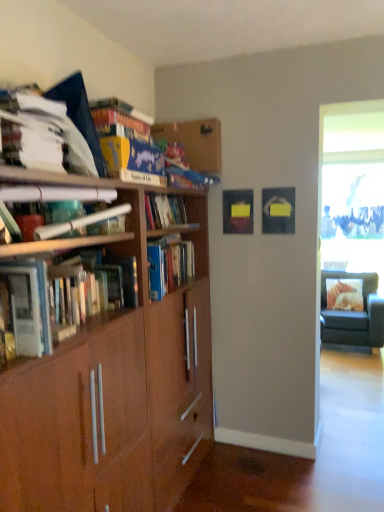
Question: Would you say brown wood bookcase at left is part of hardcover books at left, which appears as the 1th book when ordered from the bottom,'s contents?

Choices:
 (A) no
 (B) yes

Answer: (A)

Question: Considering the relative sizes of hardcover books at left, which ranks as the 4th book in top-to-bottom order, and brown wood bookcase at left in the image provided, is hardcover books at left, which ranks as the 4th book in top-to-bottom order, smaller than brown wood bookcase at left?

Choices:
 (A) no
 (B) yes

Answer: (B)

Question: From a real-world perspective, is hardcover books at left, which ranks as the 4th book in top-to-bottom order, on top of brown wood bookcase at left?

Choices:
 (A) yes
 (B) no

Answer: (A)

Question: Considering the relative sizes of hardcover books at left, which ranks as the 4th book in top-to-bottom order, and brown wood bookcase at left in the image provided, is hardcover books at left, which ranks as the 4th book in top-to-bottom order, thinner than brown wood bookcase at left?

Choices:
 (A) no
 (B) yes

Answer: (B)

Question: Considering the relative sizes of hardcover books at left, which ranks as the 4th book in top-to-bottom order, and brown wood bookcase at left in the image provided, is hardcover books at left, which ranks as the 4th book in top-to-bottom order, bigger than brown wood bookcase at left?

Choices:
 (A) no
 (B) yes

Answer: (A)

Question: From a real-world perspective, is white paper at upper left, which is counted as the 2th book, starting from the top, above or below hardcover books at left, which appears as the 1th book when ordered from the bottom?

Choices:
 (A) below
 (B) above

Answer: (B)

Question: Which is correct: white paper at upper left, which ranks as the third book in bottom-to-top order, is inside hardcover books at left, which appears as the 1th book when ordered from the bottom, or outside of it?

Choices:
 (A) inside
 (B) outside

Answer: (B)

Question: Would you say white paper at upper left, which ranks as the third book in bottom-to-top order, is to the left or to the right of hardcover books at left, which ranks as the 4th book in top-to-bottom order, in the picture?

Choices:
 (A) right
 (B) left

Answer: (B)

Question: From their relative heights in the image, would you say white paper at upper left, which ranks as the third book in bottom-to-top order, is taller or shorter than hardcover books at left, which ranks as the 4th book in top-to-bottom order?

Choices:
 (A) short
 (B) tall

Answer: (A)

Question: Is black fabric chair at right to the left or to the right of hardcover books at left, which appears as the 1th book when ordered from the bottom, in the image?

Choices:
 (A) right
 (B) left

Answer: (A)

Question: Considering the positions of black fabric chair at right and hardcover books at left, which ranks as the 4th book in top-to-bottom order, in the image, is black fabric chair at right wider or thinner than hardcover books at left, which ranks as the 4th book in top-to-bottom order,?

Choices:
 (A) thin
 (B) wide

Answer: (B)

Question: Does point (372, 271) appear closer or farther from the camera than point (54, 287)?

Choices:
 (A) closer
 (B) farther

Answer: (B)

Question: In terms of size, does black fabric chair at right appear bigger or smaller than hardcover books at left, which appears as the 1th book when ordered from the bottom?

Choices:
 (A) small
 (B) big

Answer: (B)

Question: From the image's perspective, is brown wood bookcase at left positioned above or below white paper at upper left, which is counted as the 2th book, starting from the top?

Choices:
 (A) above
 (B) below

Answer: (B)

Question: In the image, is brown wood bookcase at left on the left side or the right side of white paper at upper left, which ranks as the third book in bottom-to-top order?

Choices:
 (A) left
 (B) right

Answer: (B)